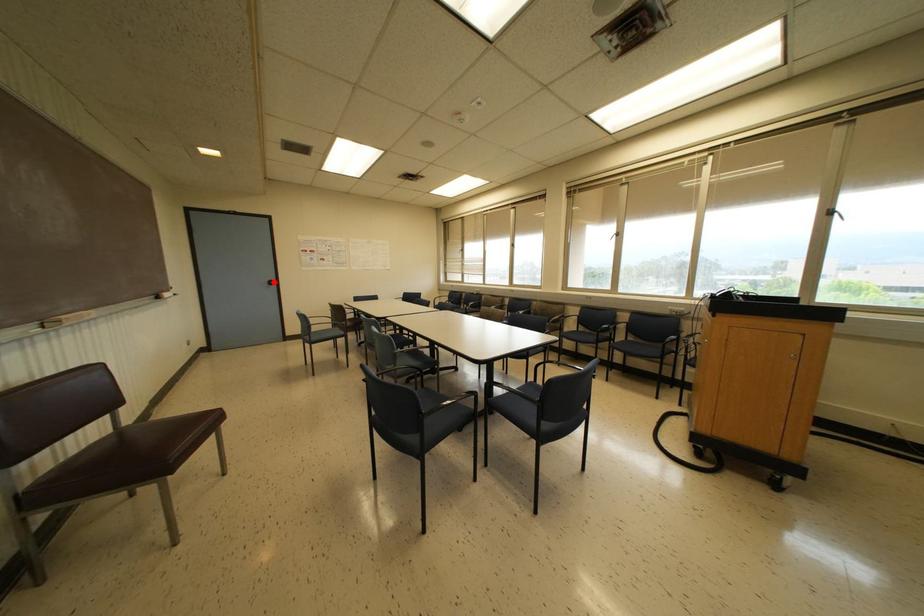
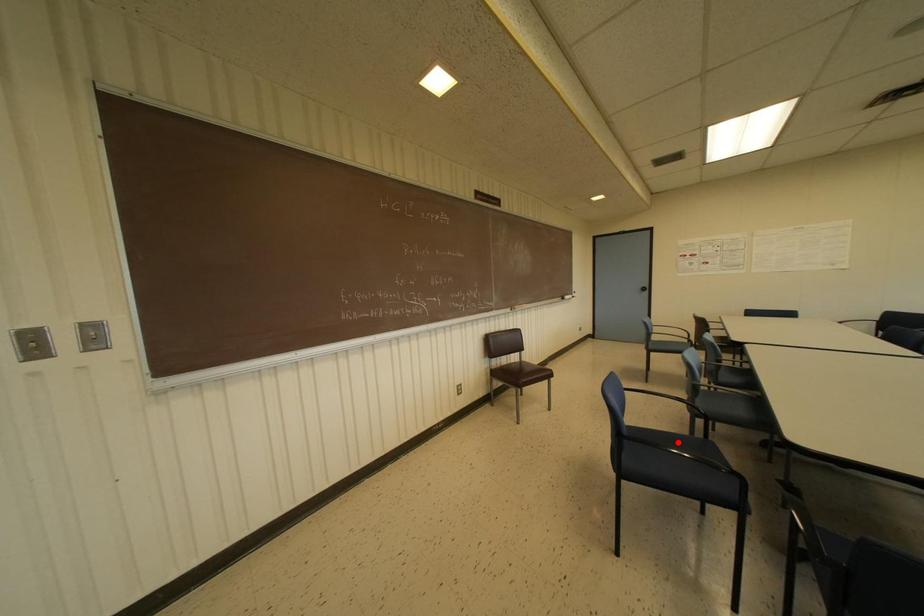
I am providing you with two images of the same scene from different viewpoints. A red point is marked on the first image and another point is marked on the second image. Does the point marked in image1 correspond to the same location as the one in image2?

No